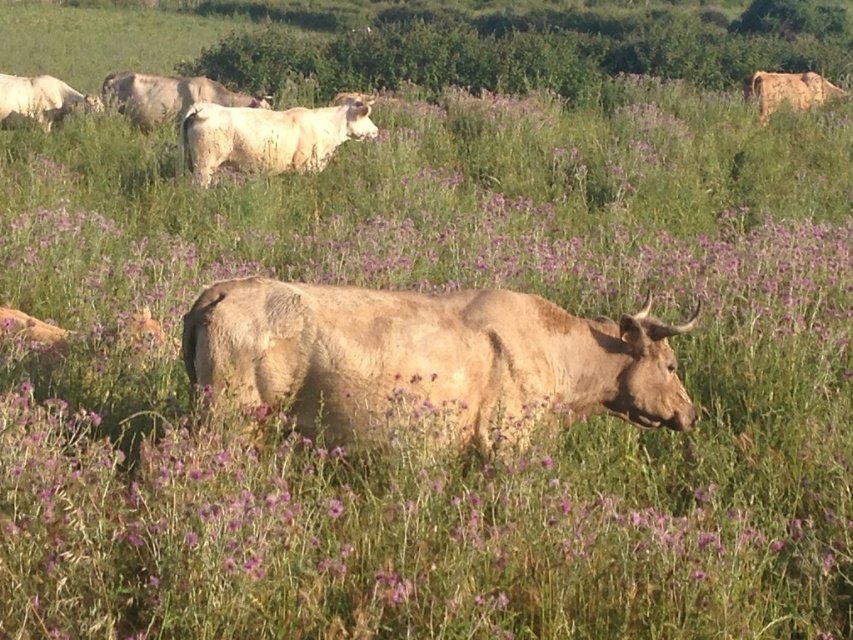
You are standing at the point marked at coordinates [268,136] in the image. Looking around, you see a white textured cow at upper center. Which direction should you walk to reach the cow?

The point marked at coordinates [268,136] is already on the white textured cow at upper center, so you are already at the cow.

In the pastoral scene, there are two cows visible in the upper part of the image. The white textured cow at upper center and the light brown textured cow at upper right. Which of these two cows is positioned more to the left side of the image?

The white textured cow at upper center is positioned more to the left side of the image compared to the light brown textured cow at upper right.

You are a photographer trying to capture a photo of both the light brown cow at upper center and the light brown textured cow at upper right. Which cow should you move your camera to the right to include in the frame?

You should move your camera to the right to include the light brown textured cow at upper right because the light brown cow at upper center is positioned on the left side of it.